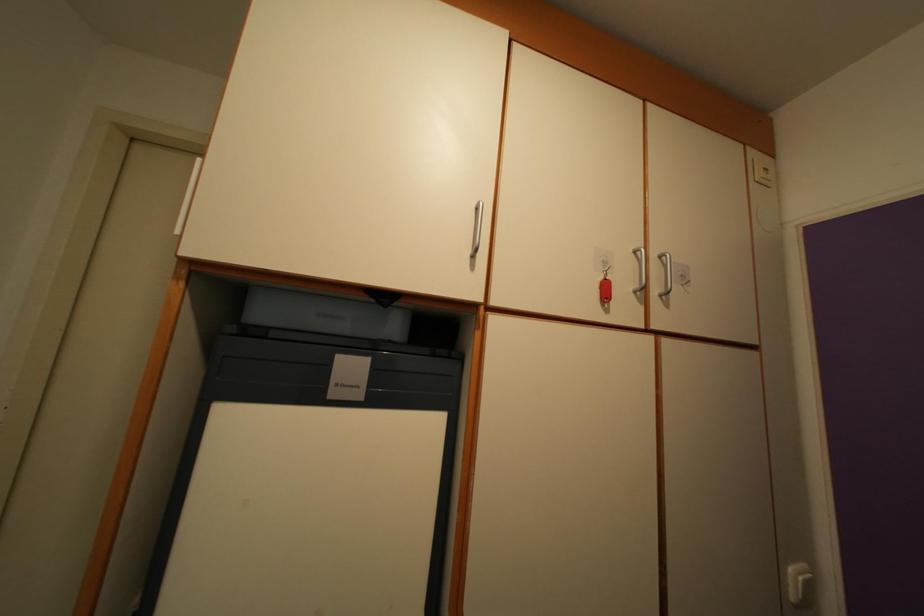
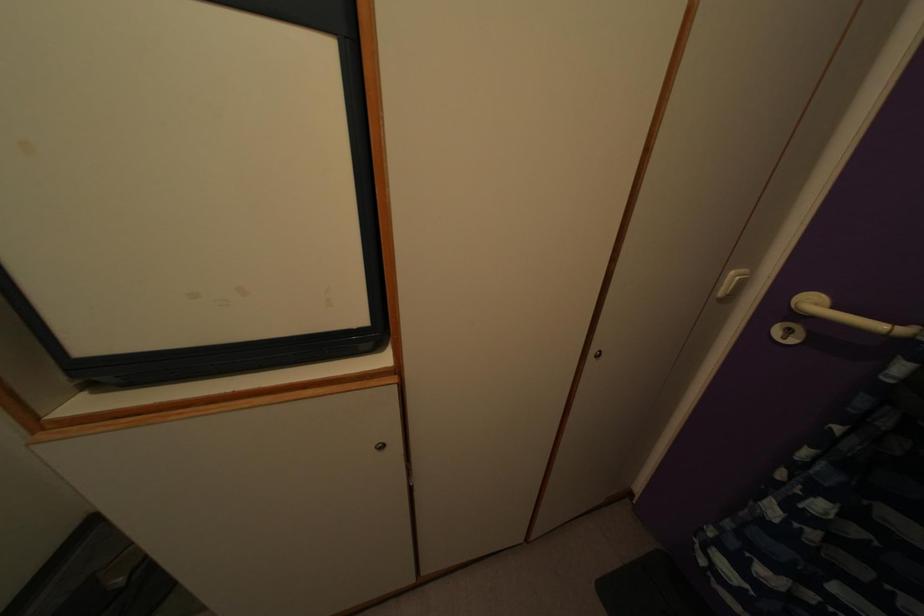
Question: I am providing you with two images of the same scene from different viewpoints. Please identify which objects are invisible in image2.

Choices:
 (A) white cabinet handle
 (B) white door handle
 (C) cabinet keyhole
 (D) none of these

Answer: (D)